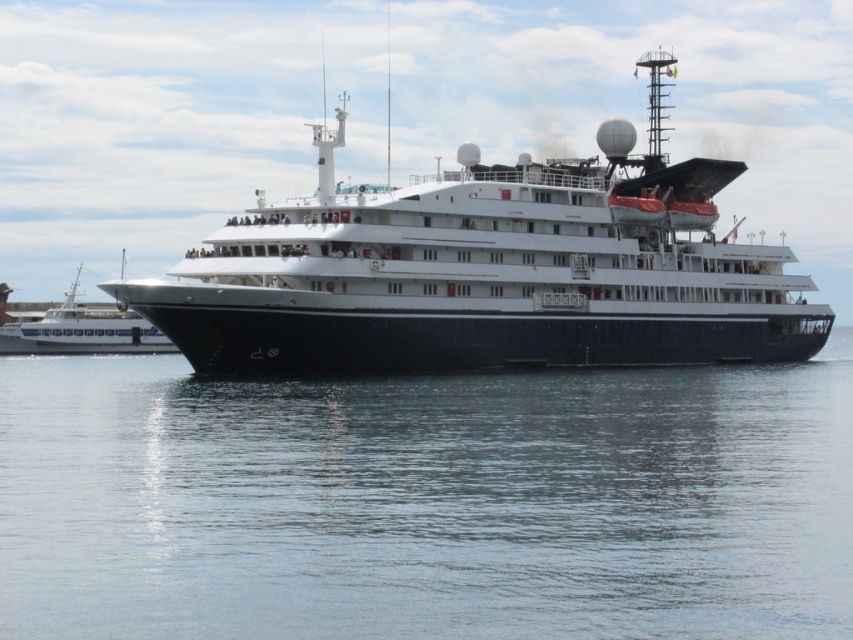
Question: Can you confirm if transparent water at center is positioned to the right of white glossy boat at left?

Choices:
 (A) no
 (B) yes

Answer: (B)

Question: Which of the following is the closest to the observer?

Choices:
 (A) (312, 454)
 (B) (70, 308)
 (C) (439, 360)

Answer: (A)

Question: Can you confirm if black glossy ship at center is positioned above white glossy boat at left?

Choices:
 (A) yes
 (B) no

Answer: (A)

Question: Estimate the real-world distances between objects in this image. Which object is closer to the black glossy ship at center?

Choices:
 (A) white glossy boat at left
 (B) transparent water at center

Answer: (B)

Question: Is transparent water at center closer to camera compared to black glossy ship at center?

Choices:
 (A) no
 (B) yes

Answer: (B)

Question: Which object is closer to the camera taking this photo?

Choices:
 (A) transparent water at center
 (B) white glossy boat at left

Answer: (A)